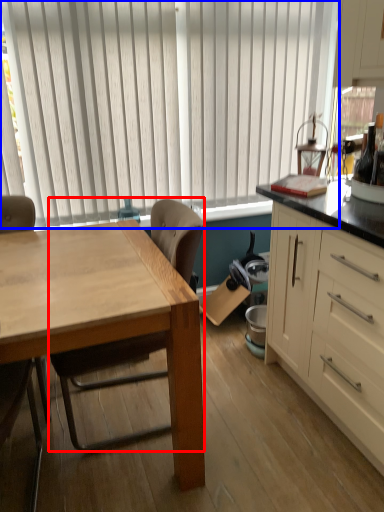
Question: Which of the following is the farthest to the observer, chair (highlighted by a red box) or window blind (highlighted by a blue box)?

Choices:
 (A) chair
 (B) window blind

Answer: (B)